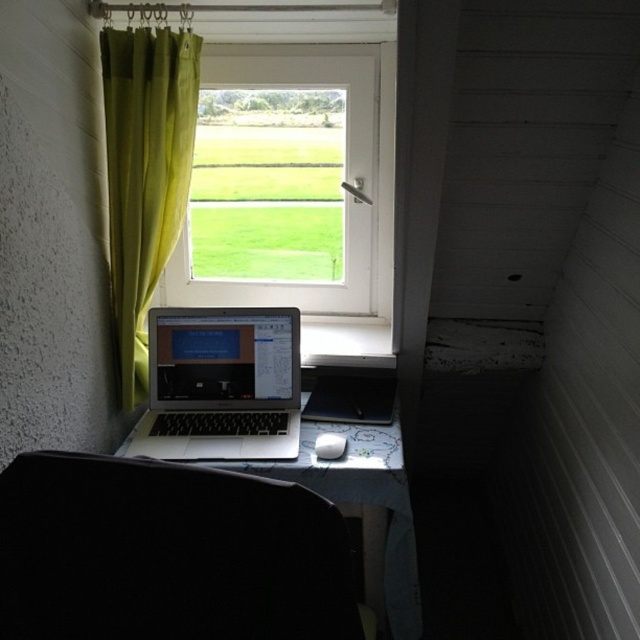
Locate an element on the screen. white plastic window at upper center is located at coordinates (282, 180).

Can you confirm if white plastic window at upper center is wider than white cloth-covered table at center?

Yes.

Which of these two, white plastic window at upper center or white cloth-covered table at center, stands taller?

Standing taller between the two is white plastic window at upper center.

Locate an element on the screen. white plastic window at upper center is located at coordinates (282, 180).

The image size is (640, 640). What are the coordinates of `white plastic window at upper center` in the screenshot? It's located at (282, 180).

Is black fabric chair at lower center below sleek silver laptop at center?

Yes, black fabric chair at lower center is below sleek silver laptop at center.

This screenshot has height=640, width=640. What do you see at coordinates (168, 554) in the screenshot? I see `black fabric chair at lower center` at bounding box center [168, 554].

Is point (19, 513) positioned behind point (225, 308)?

No, (19, 513) is in front of (225, 308).

Locate an element on the screen. black fabric chair at lower center is located at coordinates (168, 554).